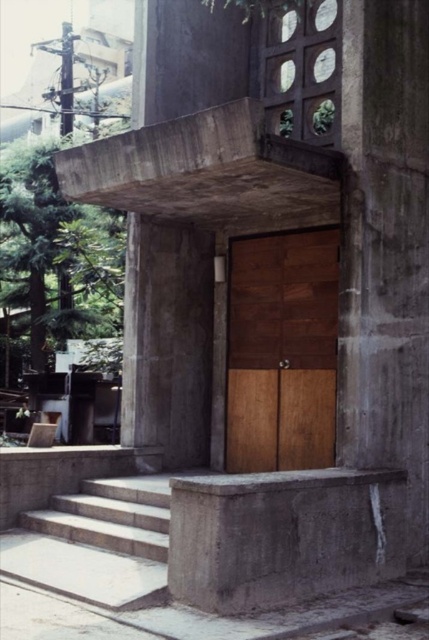
You are standing at the entrance of the building and want to see the white concrete stairs at lower left. Is the green leafy tree at left blocking your view of the stairs?

The white concrete stairs at lower left is behind green leafy tree at left, so the tree is blocking the view of the stairs.

You are a delivery person approaching the entrance and need to place a package on the ground near the white concrete stairs at lower left. However, there is a green leafy tree at left nearby. Is there enough space to place the package without it being under the tree?

The green leafy tree at left is positioned over the white concrete stairs at lower left, so placing the package there would likely put it under the tree. Choose another spot away from the stairs to ensure the package is not under the tree.